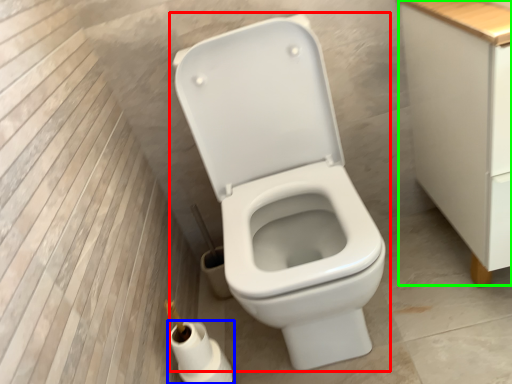
Question: Which object is the closest to the toilet (highlighted by a red box)? Choose among these: toilet paper (highlighted by a blue box) or cabinetry (highlighted by a green box).

Choices:
 (A) toilet paper
 (B) cabinetry

Answer: (B)